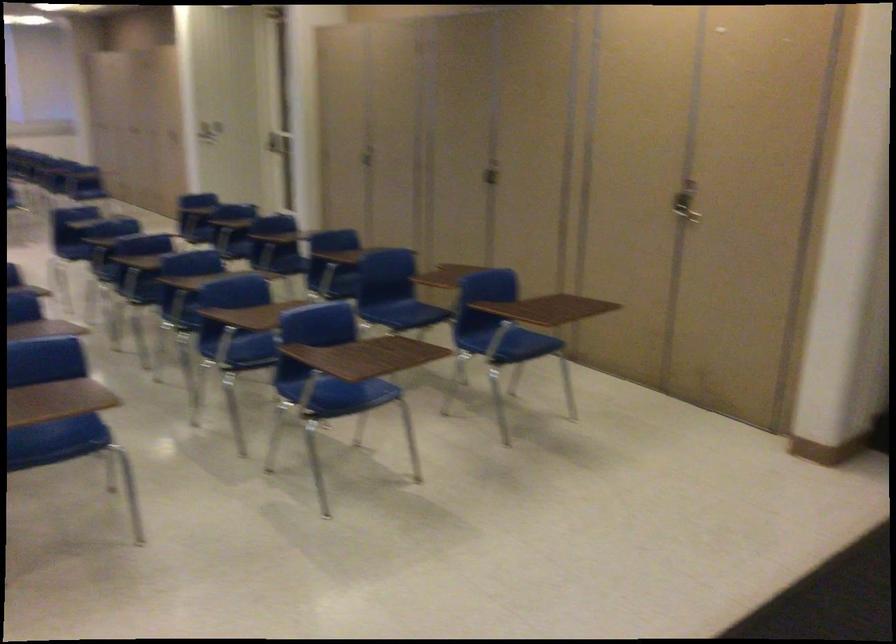
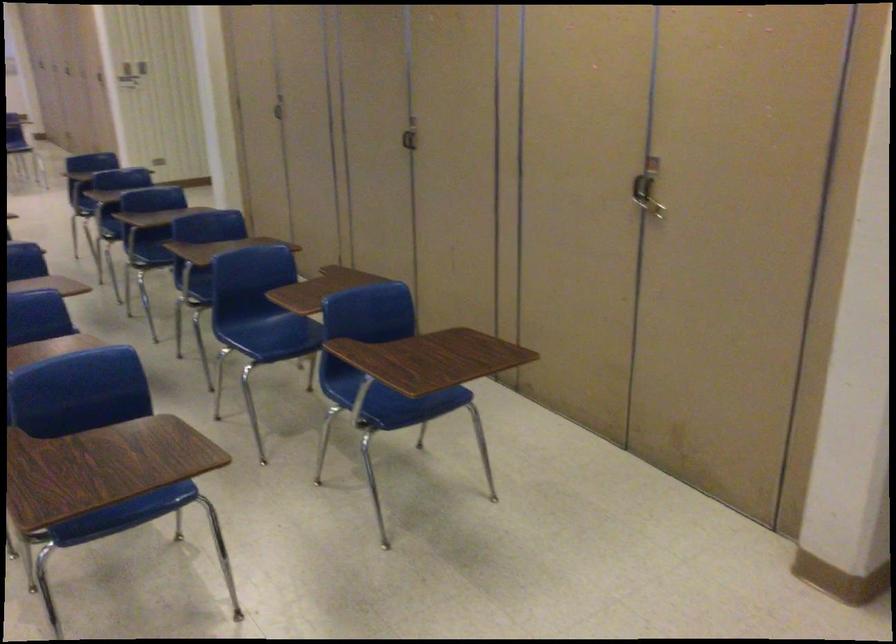
The images are taken continuously from a first-person perspective. In which direction are you moving?

The cameraman walked toward right, forward.